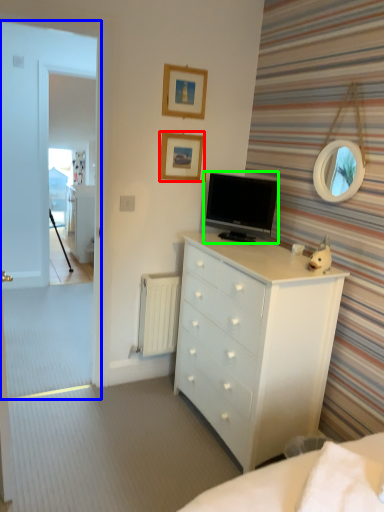
Question: Considering the real-world distances, which object is closest to picture frame (highlighted by a red box)? glass door (highlighted by a blue box) or television (highlighted by a green box).

Choices:
 (A) glass door
 (B) television

Answer: (B)